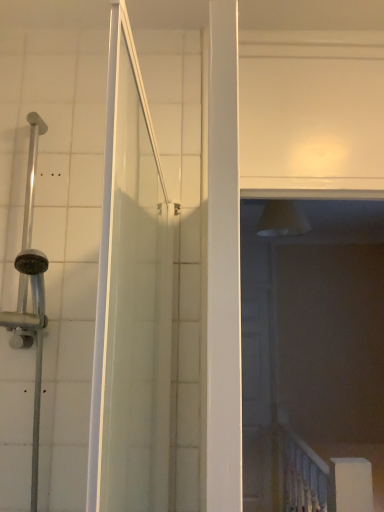
Question: Does transparent plastic screen door at center have a smaller size compared to white glossy rail at lower right?

Choices:
 (A) no
 (B) yes

Answer: (B)

Question: Would you say transparent plastic screen door at center contains white glossy rail at lower right?

Choices:
 (A) yes
 (B) no

Answer: (B)

Question: Considering the relative positions of transparent plastic screen door at center and white glossy rail at lower right in the image provided, is transparent plastic screen door at center to the right of white glossy rail at lower right from the viewer's perspective?

Choices:
 (A) yes
 (B) no

Answer: (B)

Question: Does transparent plastic screen door at center come behind white glossy rail at lower right?

Choices:
 (A) yes
 (B) no

Answer: (A)

Question: Does transparent plastic screen door at center turn towards white glossy rail at lower right?

Choices:
 (A) no
 (B) yes

Answer: (B)

Question: From the image's perspective, is transparent plastic screen door at center over white glossy rail at lower right?

Choices:
 (A) yes
 (B) no

Answer: (A)

Question: Is transparent plastic screen door at center completely or partially inside white glossy rail at lower right?

Choices:
 (A) yes
 (B) no

Answer: (B)

Question: Considering the relative sizes of white glossy rail at lower right and transparent plastic screen door at center in the image provided, is white glossy rail at lower right thinner than transparent plastic screen door at center?

Choices:
 (A) no
 (B) yes

Answer: (A)

Question: From the image's perspective, is white glossy rail at lower right located beneath transparent plastic screen door at center?

Choices:
 (A) no
 (B) yes

Answer: (B)

Question: From a real-world perspective, is white glossy rail at lower right positioned under transparent plastic screen door at center based on gravity?

Choices:
 (A) no
 (B) yes

Answer: (B)

Question: Are white glossy rail at lower right and transparent plastic screen door at center far apart?

Choices:
 (A) yes
 (B) no

Answer: (B)

Question: From the image's perspective, is white glossy rail at lower right on transparent plastic screen door at center?

Choices:
 (A) no
 (B) yes

Answer: (A)

Question: Choose the correct answer: Is transparent plastic screen door at center inside white glossy rail at lower right or outside it?

Choices:
 (A) inside
 (B) outside

Answer: (B)